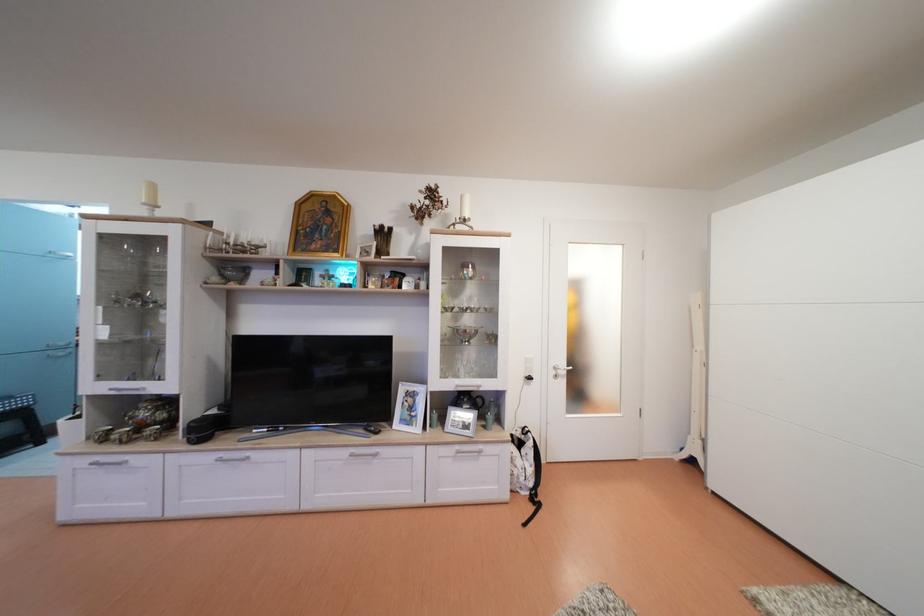
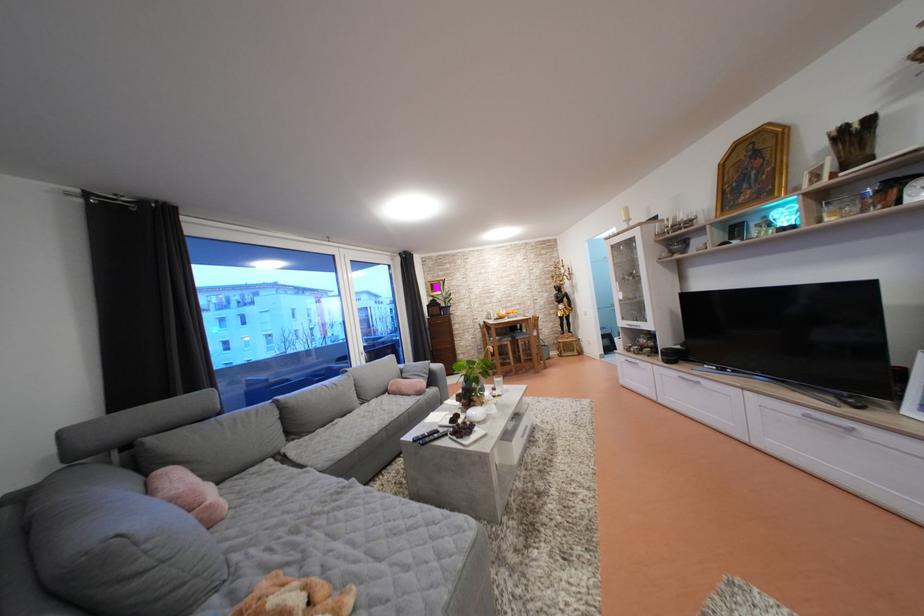
Where in the second image is the point corresponding to (91,467) from the first image?

(630, 363)